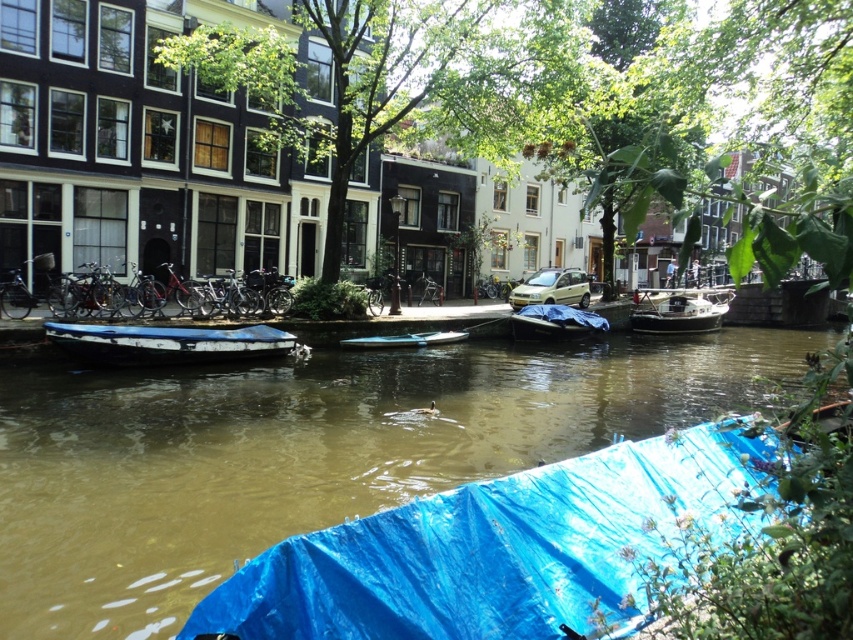
Between point (62, 323) and point (717, 316), which one is positioned behind?

The point (717, 316) is behind.

Can you confirm if blue tarpaulin boat at center is positioned above shiny silver boat at center?

Incorrect, blue tarpaulin boat at center is not positioned above shiny silver boat at center.

Who is more forward, (122, 346) or (665, 307)?

Point (122, 346) is more forward.

Where is `blue tarpaulin boat at center`? This screenshot has height=640, width=853. blue tarpaulin boat at center is located at coordinates (165, 342).

How much distance is there between blue tarp at center and blue tarp-covered boat at center?

blue tarp at center and blue tarp-covered boat at center are 15.25 feet apart from each other.

Between blue tarp at center and blue tarp-covered boat at center, which one appears on the left side from the viewer's perspective?

blue tarp at center

Is point (223, 388) positioned before point (585, 314)?

Yes, point (223, 388) is closer to viewer.

I want to click on blue tarp at center, so click(306, 452).

Between blue tarp at center and white plastic boat at center, which one is positioned higher?

white plastic boat at center is above.

Is point (511, 352) more distant than point (347, 346)?

Yes.

Between point (170, 636) and point (421, 339), which one is positioned behind?

The point (421, 339) is more distant.

Identify the location of blue tarp at center. The width and height of the screenshot is (853, 640). (306, 452).